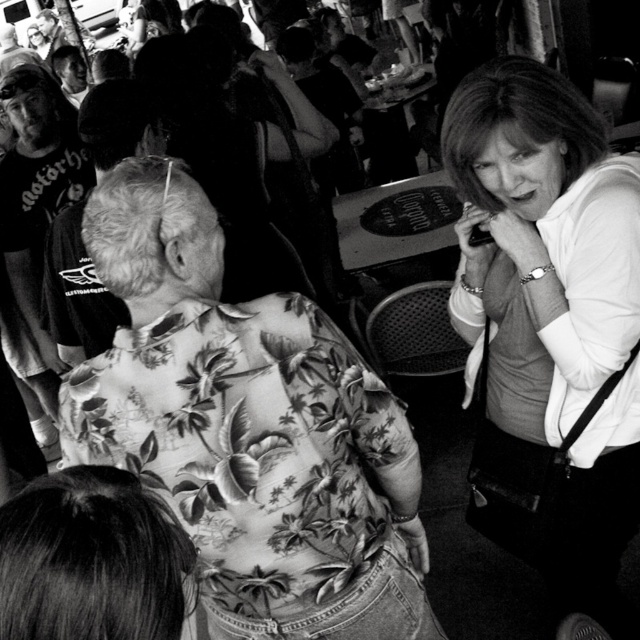
Question: Which of the following is the farthest from the observer?

Choices:
 (A) floral print shirt at center
 (B) matte white shirt at right
 (C) matte black t-shirt at left

Answer: (C)

Question: Does floral print shirt at center have a greater width compared to matte white shirt at right?

Choices:
 (A) no
 (B) yes

Answer: (B)

Question: Which object is positioned farthest from the floral print shirt at center?

Choices:
 (A) matte black t-shirt at left
 (B) matte white shirt at right

Answer: (A)

Question: Where is floral print shirt at center located in relation to matte white shirt at right in the image?

Choices:
 (A) left
 (B) right

Answer: (A)

Question: Does matte white shirt at right appear on the right side of matte black t-shirt at left?

Choices:
 (A) yes
 (B) no

Answer: (A)

Question: Which object is farther from the camera taking this photo?

Choices:
 (A) floral print shirt at center
 (B) matte white shirt at right

Answer: (B)